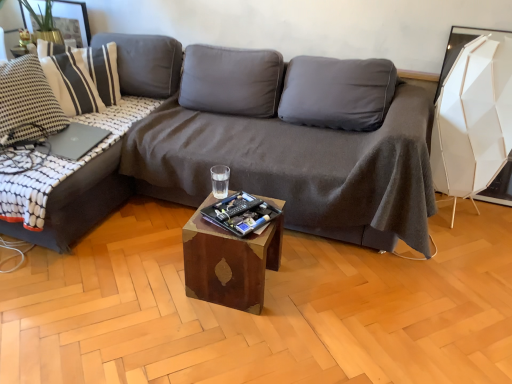
Question: Could you tell me if dark gray fabric couch at center, placed as the second studio couch when sorted from left to right, is facing wooden cube at center?

Choices:
 (A) no
 (B) yes

Answer: (B)

Question: Does dark gray fabric couch at center, placed as the 1th studio couch when sorted from right to left, touch wooden cube at center?

Choices:
 (A) no
 (B) yes

Answer: (A)

Question: From the image's perspective, would you say dark gray fabric couch at center, placed as the second studio couch when sorted from left to right, is positioned over wooden cube at center?

Choices:
 (A) yes
 (B) no

Answer: (A)

Question: Can you confirm if dark gray fabric couch at center, placed as the 1th studio couch when sorted from right to left, is smaller than wooden cube at center?

Choices:
 (A) yes
 (B) no

Answer: (B)

Question: Is dark gray fabric couch at center, placed as the second studio couch when sorted from left to right, far from wooden cube at center?

Choices:
 (A) yes
 (B) no

Answer: (B)

Question: Does dark gray fabric couch at center, placed as the second studio couch when sorted from left to right, have a greater height compared to wooden cube at center?

Choices:
 (A) no
 (B) yes

Answer: (B)

Question: Is dark gray fabric couch at center, placed as the 1th studio couch when sorted from right to left, shorter than dark gray fabric couch at left, the 2th studio couch when ordered from right to left?

Choices:
 (A) yes
 (B) no

Answer: (A)

Question: From the image's perspective, does dark gray fabric couch at center, placed as the 1th studio couch when sorted from right to left, appear lower than dark gray fabric couch at left, arranged as the first studio couch when viewed from the left?

Choices:
 (A) no
 (B) yes

Answer: (B)

Question: Is dark gray fabric couch at center, placed as the second studio couch when sorted from left to right, taller than dark gray fabric couch at left, the 2th studio couch when ordered from right to left?

Choices:
 (A) yes
 (B) no

Answer: (B)

Question: From the image's perspective, would you say dark gray fabric couch at center, placed as the 1th studio couch when sorted from right to left, is positioned over dark gray fabric couch at left, the 2th studio couch when ordered from right to left?

Choices:
 (A) no
 (B) yes

Answer: (A)

Question: Can you confirm if dark gray fabric couch at center, placed as the 1th studio couch when sorted from right to left, is thinner than dark gray fabric couch at left, arranged as the first studio couch when viewed from the left?

Choices:
 (A) yes
 (B) no

Answer: (B)

Question: Is dark gray fabric couch at center, placed as the 1th studio couch when sorted from right to left, to the right of dark gray fabric couch at left, arranged as the first studio couch when viewed from the left, from the viewer's perspective?

Choices:
 (A) yes
 (B) no

Answer: (A)

Question: Is dark gray fabric couch at left, the 2th studio couch when ordered from right to left, at the left side of wooden cube at center?

Choices:
 (A) no
 (B) yes

Answer: (B)